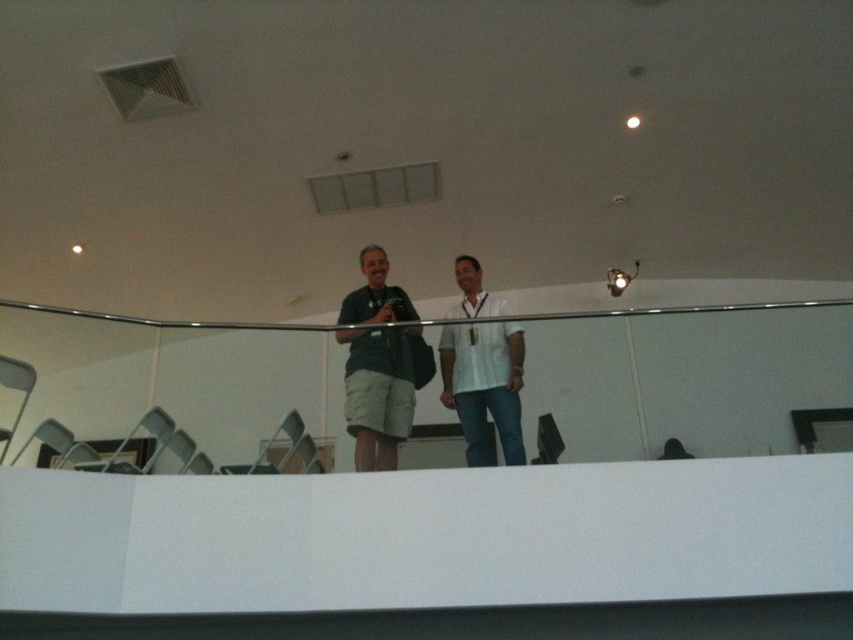
Question: Does dark green fabric shirt at center have a larger size compared to white striped shirt at center?

Choices:
 (A) no
 (B) yes

Answer: (B)

Question: Which point is farther to the camera?

Choices:
 (A) (485, 349)
 (B) (407, 385)

Answer: (A)

Question: Is dark green fabric shirt at center in front of white striped shirt at center?

Choices:
 (A) yes
 (B) no

Answer: (A)

Question: Does dark green fabric shirt at center have a lesser width compared to white striped shirt at center?

Choices:
 (A) yes
 (B) no

Answer: (B)